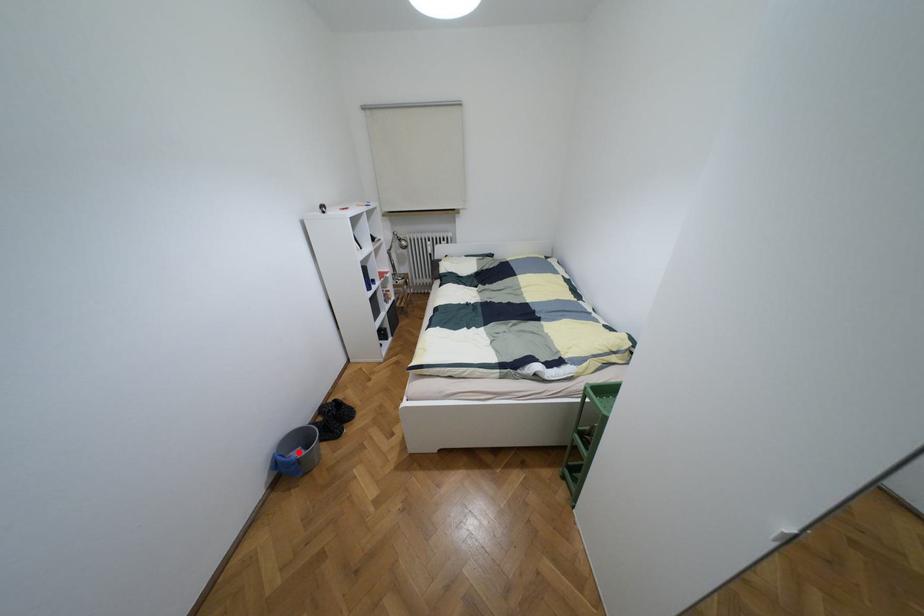
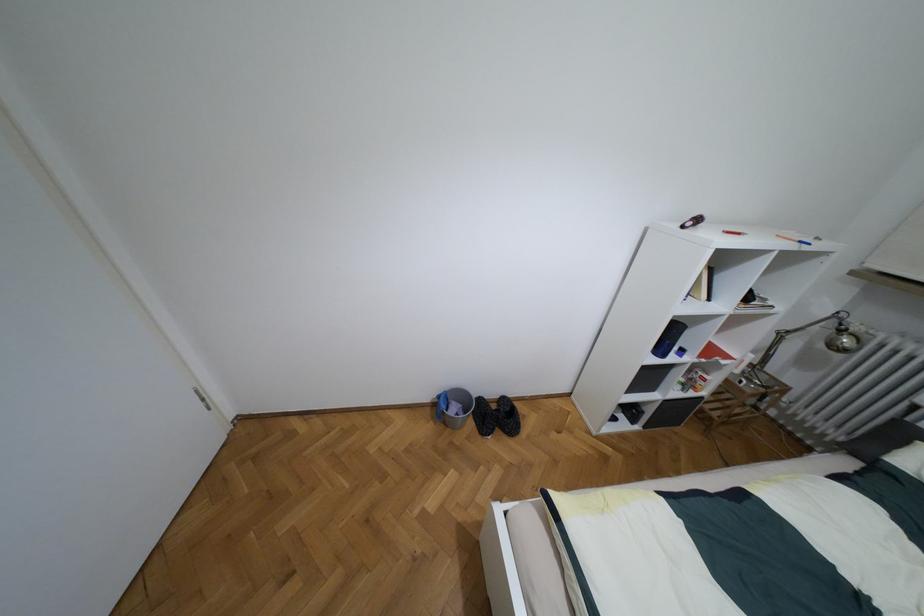
Question: I am providing you with two images of the same scene from different viewpoints. A red point is shown in image1. For the corresponding object point in image2, is it positioned nearer or farther from the camera?

Choices:
 (A) Nearer
 (B) Farther

Answer: (B)